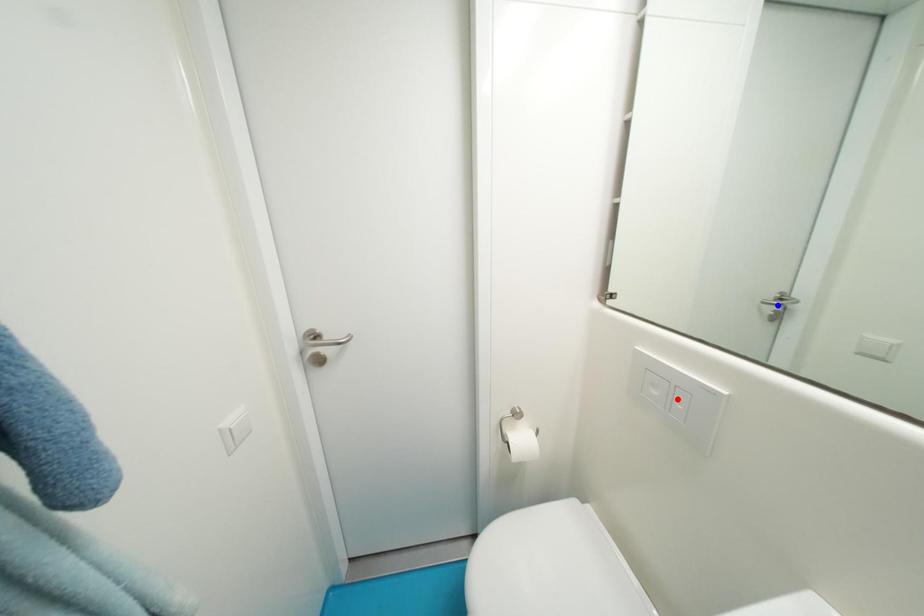
Question: Which of the two points in the image is closer to the camera?

Choices:
 (A) Blue point is closer.
 (B) Red point is closer.

Answer: (B)